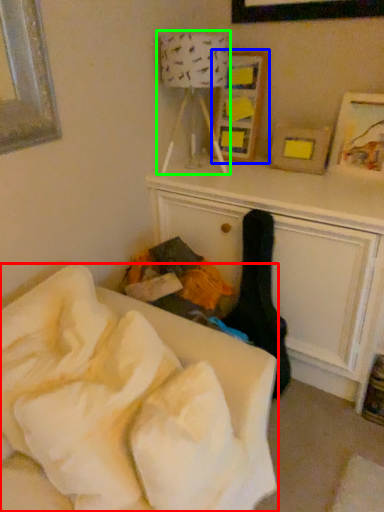
Question: Estimate the real-world distances between objects in this image. Which object is closer to furniture (highlighted by a red box), picture frame (highlighted by a blue box) or lamp (highlighted by a green box)?

Choices:
 (A) picture frame
 (B) lamp

Answer: (B)